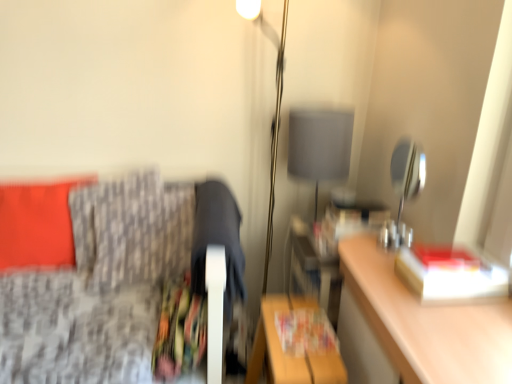
Question: Is metallic gray lampshade at upper right, which is counted as the 1th table lamp, starting from the front, closer to the viewer compared to printed paper magazine at lower center, the 2th magazine positioned from the right?

Choices:
 (A) yes
 (B) no

Answer: (A)

Question: Would you say metallic gray lampshade at upper right, which is counted as the 1th table lamp, starting from the front, contains printed paper magazine at lower center, which is the first magazine from front to back?

Choices:
 (A) yes
 (B) no

Answer: (B)

Question: From a real-world perspective, is metallic gray lampshade at upper right, positioned as the first table lamp in right-to-left order, located higher than printed paper magazine at lower center, the 2th magazine positioned from the right?

Choices:
 (A) yes
 (B) no

Answer: (A)

Question: Is printed paper magazine at lower center, the 2th magazine positioned from the right, at the back of metallic gray lampshade at upper right, which is counted as the 2th table lamp, starting from the left?

Choices:
 (A) yes
 (B) no

Answer: (B)

Question: Does metallic gray lampshade at upper right, positioned as the first table lamp in right-to-left order, have a lesser width compared to printed paper magazine at lower center, the 2th magazine viewed from the top?

Choices:
 (A) yes
 (B) no

Answer: (A)

Question: Is metallic gray lampshade at upper right, which is counted as the 2th table lamp, starting from the left, completely or partially outside of printed paper magazine at lower center, positioned as the first magazine in left-to-right order?

Choices:
 (A) no
 (B) yes

Answer: (B)

Question: Are metallic gray lampshade at upper right, positioned as the 2th table lamp in back-to-front order, and matte orange pillow at left, which ranks as the second pillow in right-to-left order, far apart?

Choices:
 (A) yes
 (B) no

Answer: (A)

Question: Considering the relative sizes of metallic gray lampshade at upper right, which is counted as the 2th table lamp, starting from the left, and matte orange pillow at left, placed as the first pillow when sorted from left to right, in the image provided, is metallic gray lampshade at upper right, which is counted as the 2th table lamp, starting from the left, thinner than matte orange pillow at left, placed as the first pillow when sorted from left to right,?

Choices:
 (A) no
 (B) yes

Answer: (B)

Question: Is metallic gray lampshade at upper right, which is counted as the 2th table lamp, starting from the left, wider than matte orange pillow at left, which ranks as the second pillow in right-to-left order?

Choices:
 (A) no
 (B) yes

Answer: (A)

Question: Does metallic gray lampshade at upper right, which is counted as the 1th table lamp, starting from the front, have a smaller size compared to matte orange pillow at left, which ranks as the second pillow in right-to-left order?

Choices:
 (A) yes
 (B) no

Answer: (A)

Question: Can you see metallic gray lampshade at upper right, which is counted as the 2th table lamp, starting from the left, touching matte orange pillow at left, which ranks as the second pillow in right-to-left order?

Choices:
 (A) yes
 (B) no

Answer: (B)

Question: Does metallic gray lampshade at upper right, positioned as the first table lamp in right-to-left order, come behind matte orange pillow at left, which ranks as the second pillow in right-to-left order?

Choices:
 (A) no
 (B) yes

Answer: (A)

Question: From a real-world perspective, is wooden table at lower center below patterned fabric pillow at left, which is the second pillow in left-to-right order?

Choices:
 (A) yes
 (B) no

Answer: (A)